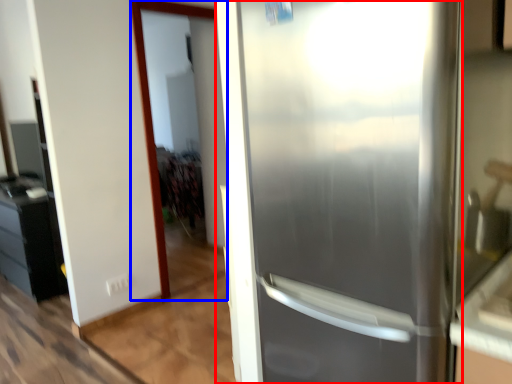
Question: Which object appears farthest to the camera in this image, refrigerator (highlighted by a red box) or screen door (highlighted by a blue box)?

Choices:
 (A) refrigerator
 (B) screen door

Answer: (B)